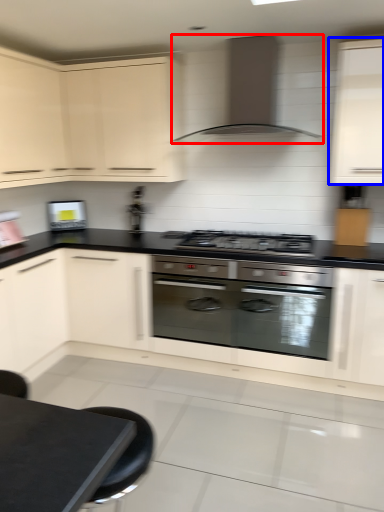
Question: Which point is closer to the camera, home appliance (highlighted by a red box) or cabinetry (highlighted by a blue box)?

Choices:
 (A) home appliance
 (B) cabinetry

Answer: (B)